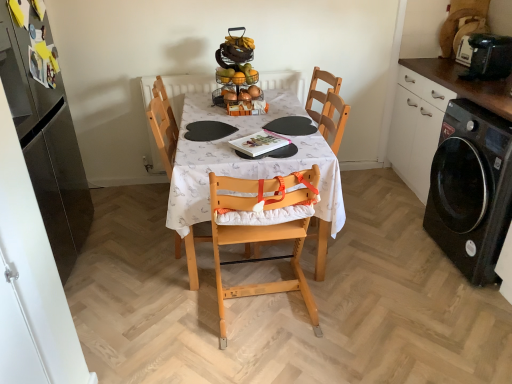
Question: From their relative heights in the image, would you say black glossy washing machine at right is taller or shorter than black plastic toaster at upper right?

Choices:
 (A) tall
 (B) short

Answer: (A)

Question: Is black glossy washing machine at right in front of or behind black plastic toaster at upper right in the image?

Choices:
 (A) front
 (B) behind

Answer: (A)

Question: Based on their relative distances, which object is nearer to the white fabric table at center?

Choices:
 (A) black plastic toaster at upper right
 (B) black glossy washing machine at right
 (C) light wood highchair at center, which is counted as the 2th chair, starting from the right
 (D) light wood highchair at center, which is the 2th chair in left-to-right order
 (E) glossy stainless steel refrigerator at left, which appears as the second cabinetry when viewed from the right

Answer: (D)

Question: Which is nearer to the black matte cabinet at right, the first cabinetry from the right?

Choices:
 (A) black plastic toaster at upper right
 (B) black glossy washing machine at right
 (C) glossy stainless steel refrigerator at left, the 1th cabinetry viewed from the left
 (D) white fabric table at center
 (E) light wood highchair at center, the first chair viewed from the right

Answer: (A)